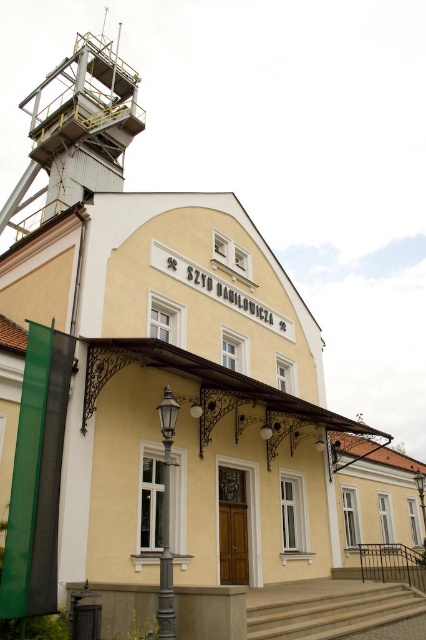
Between yellow metallic tower at upper left and concrete stairs at lower center, which one is positioned higher?

yellow metallic tower at upper left is above.

Who is more forward, (57, 205) or (393, 605)?

Point (393, 605) is in front.

Which is behind, point (112, 108) or point (268, 598)?

Positioned behind is point (112, 108).

This screenshot has height=640, width=426. I want to click on yellow metallic tower at upper left, so click(77, 129).